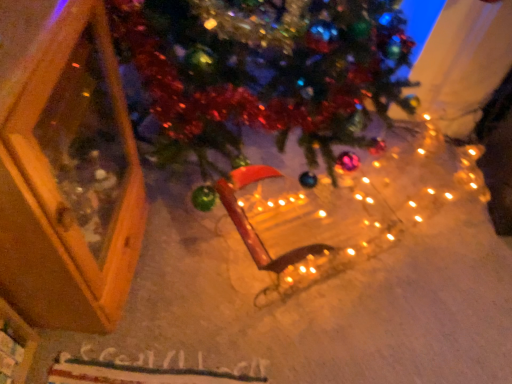
Question: Looking at their shapes, would you say wooden sled at center is wider or thinner than wooden frame at left?

Choices:
 (A) wide
 (B) thin

Answer: (B)

Question: From a real-world perspective, relative to wooden frame at left, is wooden sled at center vertically above or below?

Choices:
 (A) above
 (B) below

Answer: (B)

Question: Is wooden sled at center spatially inside wooden frame at left, or outside of it?

Choices:
 (A) outside
 (B) inside

Answer: (A)

Question: Is point (42, 19) positioned closer to the camera than point (407, 208)?

Choices:
 (A) closer
 (B) farther

Answer: (A)

Question: From the image's perspective, is wooden frame at left located above or below wooden sled at center?

Choices:
 (A) above
 (B) below

Answer: (A)

Question: Considering their positions, is wooden frame at left located in front of or behind wooden sled at center?

Choices:
 (A) behind
 (B) front

Answer: (B)

Question: From a real-world perspective, is wooden frame at left positioned above or below wooden sled at center?

Choices:
 (A) below
 (B) above

Answer: (B)